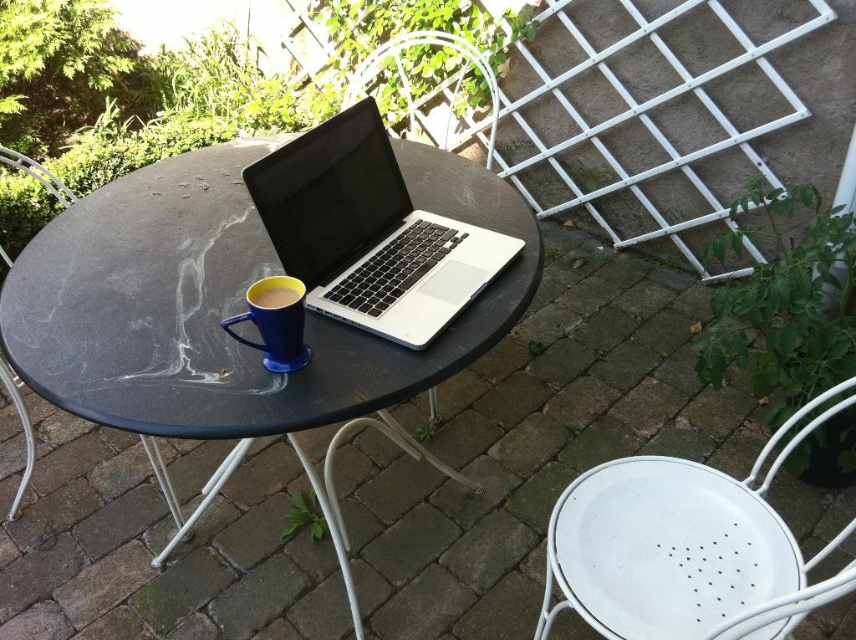
Question: Can you confirm if white perforated chair at lower right is bigger than matte ceramic mug at center?

Choices:
 (A) yes
 (B) no

Answer: (A)

Question: Which point appears farthest from the camera in this image?

Choices:
 (A) (284, 296)
 (B) (414, 36)

Answer: (B)

Question: Is matte blue mug at center closer to the viewer compared to matte ceramic mug at center?

Choices:
 (A) no
 (B) yes

Answer: (B)

Question: Which is nearer to the white perforated chair at lower right?

Choices:
 (A) matte ceramic mug at center
 (B) black marble table at center
 (C) matte blue mug at center
 (D) silver/black matte laptop at center

Answer: (D)

Question: Among these points, which one is nearest to the camera?

Choices:
 (A) (262, 300)
 (B) (497, 108)

Answer: (A)

Question: Is matte blue mug at center in front of white metal chair at upper center?

Choices:
 (A) no
 (B) yes

Answer: (B)